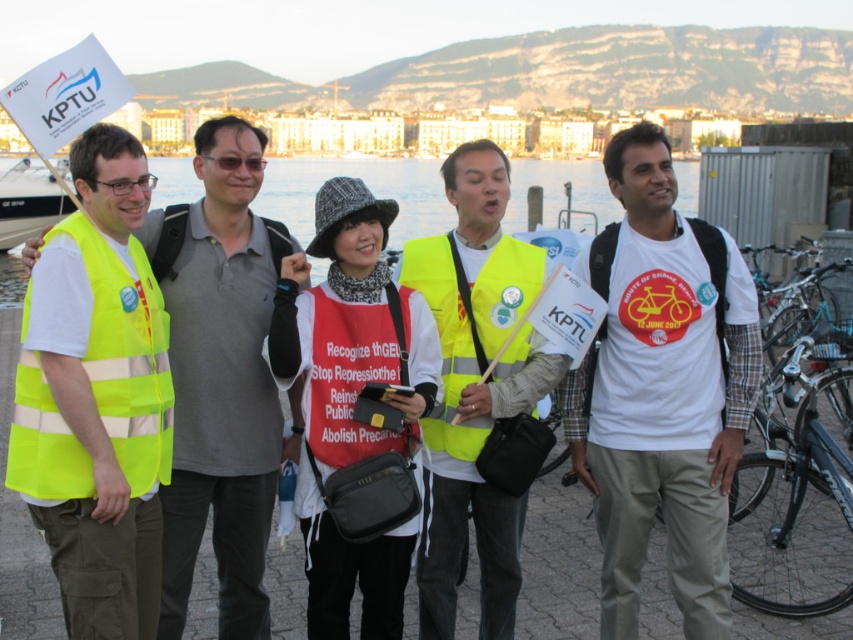
Consider the image. Does matte black glasses at left appear under black plastic goggles at center?

Yes.

Can you confirm if matte black glasses at left is wider than black plastic goggles at center?

Yes, matte black glasses at left is wider than black plastic goggles at center.

Between point (148, 186) and point (242, 157), which one is positioned in front?

Positioned in front is point (148, 186).

This screenshot has height=640, width=853. What are the coordinates of `matte black glasses at left` in the screenshot? It's located at (129, 184).

Who is higher up, yellow reflective safety vest at center or white plastic boat at left?

white plastic boat at left

Find the location of `yellow reflective safety vest at center`. yellow reflective safety vest at center is located at coordinates (469, 323).

The image size is (853, 640). What are the coordinates of `yellow reflective safety vest at center` in the screenshot? It's located at (469, 323).

Can you confirm if neon yellow vest at left is shorter than black plastic goggles at center?

Incorrect, neon yellow vest at left's height does not fall short of black plastic goggles at center's.

Can you confirm if neon yellow vest at left is taller than black plastic goggles at center?

Correct, neon yellow vest at left is much taller as black plastic goggles at center.

Who is more forward, (221,432) or (231,157)?

Point (221,432)

Locate an element on the screen. Image resolution: width=853 pixels, height=640 pixels. neon yellow vest at left is located at coordinates (224, 428).